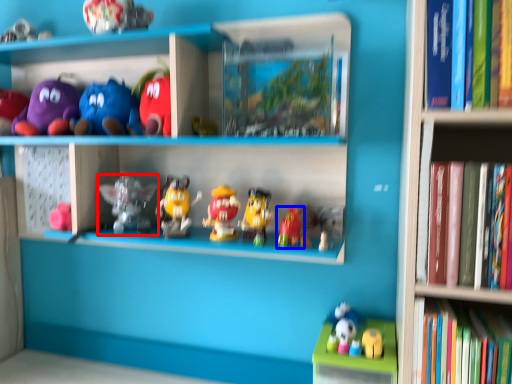
Question: Which object appears closest to the camera in this image, toy (highlighted by a red box) or toy (highlighted by a blue box)?

Choices:
 (A) toy
 (B) toy

Answer: (B)